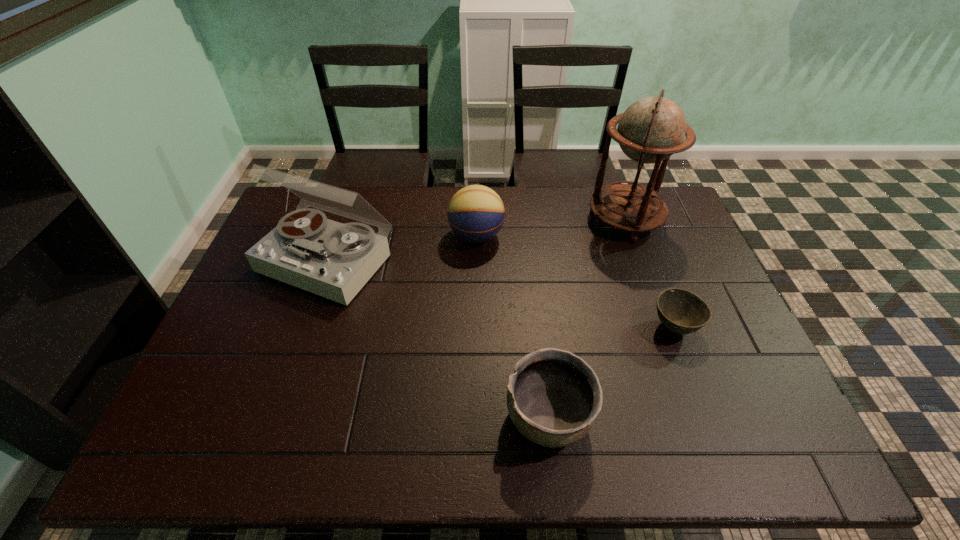
The width and height of the screenshot is (960, 540). Find the location of `the tallest object`. the tallest object is located at coordinates (653, 128).

Identify the location of the leftmost object. (334, 260).

Where is `record player`? The width and height of the screenshot is (960, 540). record player is located at coordinates point(334,260).

Find the location of a particular element. The width and height of the screenshot is (960, 540). the third shortest object is located at coordinates (476, 213).

You are a GUI agent. You are given a task and a screenshot of the screen. Output one action in this format:
    pyautogui.click(x=<x>, y=<y>)
    Task: Click on the fourth tallest object
    The width and height of the screenshot is (960, 540).
    Given the screenshot: What is the action you would take?
    pyautogui.click(x=553, y=398)

Identify the location of pottery. (553, 398).

Locate an element on the screen. The width and height of the screenshot is (960, 540). the fourth farthest object is located at coordinates (680, 311).

The width and height of the screenshot is (960, 540). I want to click on the shortest object, so click(x=680, y=311).

Locate an element on the screen. The width and height of the screenshot is (960, 540). free spot located 0.130m on the surface of the globe is located at coordinates (550, 220).

At what (x,y) coordinates should I click in order to perform the action: click on free space located on the surface of the globe. Please return your answer as a coordinate pair (x, y). The image size is (960, 540). Looking at the image, I should click on (573, 220).